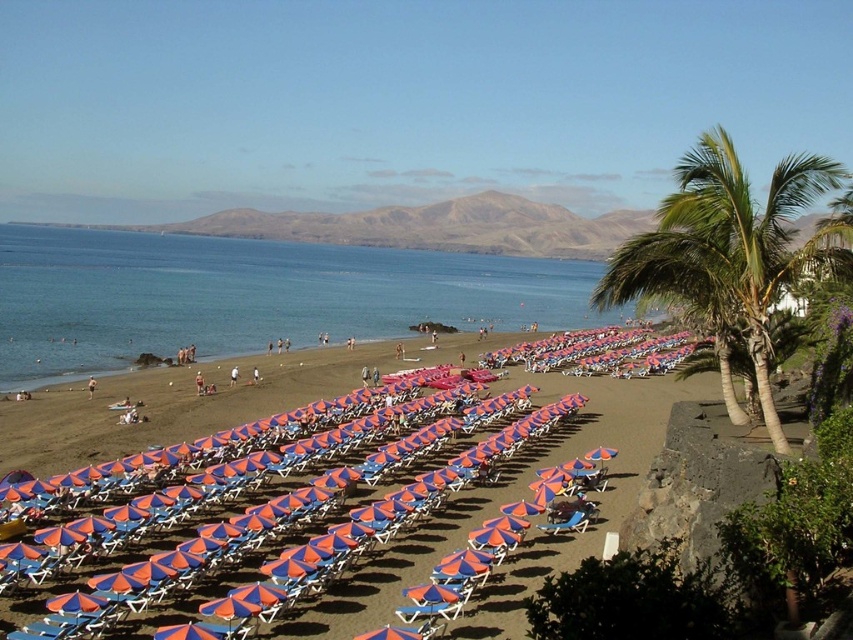
Question: Is blue water at left to the left of blue fabric beach chair at center from the viewer's perspective?

Choices:
 (A) no
 (B) yes

Answer: (B)

Question: Which point is closer to the camera?

Choices:
 (A) (764, 252)
 (B) (550, 532)

Answer: (A)

Question: Does blue water at left appear over blue fabric beach chair at center?

Choices:
 (A) yes
 (B) no

Answer: (A)

Question: Does blue water at left appear under green leafy palm tree at right?

Choices:
 (A) yes
 (B) no

Answer: (B)

Question: Which object is positioned farthest from the blue water at left?

Choices:
 (A) blue fabric beach chair at center
 (B) green leafy palm tree at right

Answer: (B)

Question: Which of the following is the farthest from the observer?

Choices:
 (A) (573, 518)
 (B) (723, 260)

Answer: (A)